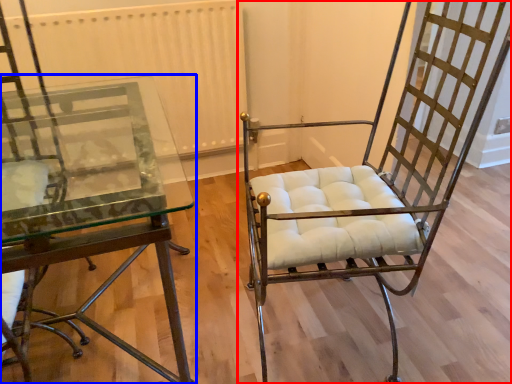
Question: Which object appears farthest to the camera in this image, chair (highlighted by a red box) or table (highlighted by a blue box)?

Choices:
 (A) chair
 (B) table

Answer: (A)